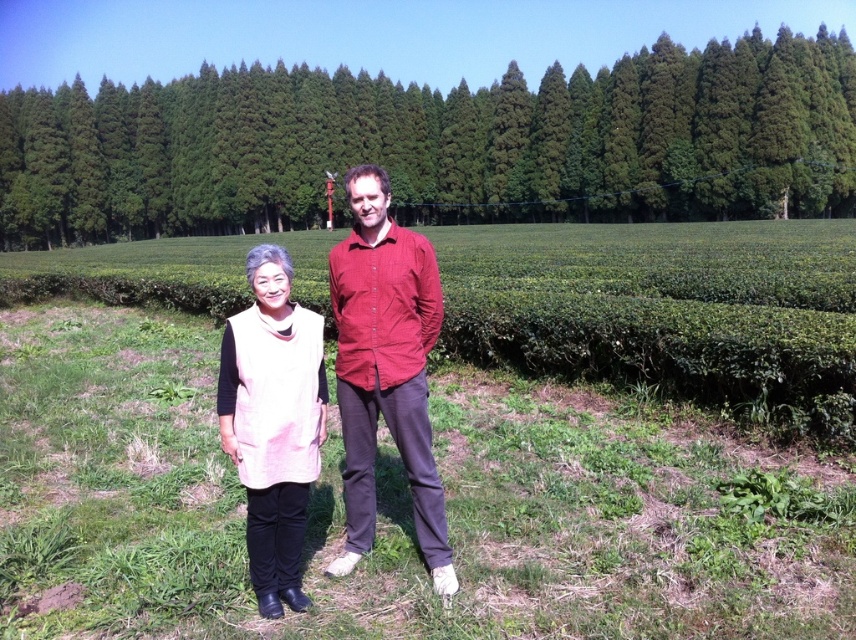
Question: Is green leafy trees at center positioned behind pink fabric vest at center?

Choices:
 (A) yes
 (B) no

Answer: (A)

Question: Which object is closer to the camera taking this photo?

Choices:
 (A) pink fabric vest at center
 (B) green leafy trees at center

Answer: (A)

Question: Estimate the real-world distances between objects in this image. Which object is farther from the green leafy vineyard at center?

Choices:
 (A) pink fabric vest at center
 (B) matte red shirt at center

Answer: (A)

Question: Is green leafy trees at center bigger than pink fabric vest at center?

Choices:
 (A) no
 (B) yes

Answer: (B)

Question: Observing the image, what is the correct spatial positioning of green leafy vineyard at center in reference to green leafy trees at center?

Choices:
 (A) above
 (B) below

Answer: (B)

Question: Which point is closer to the camera taking this photo?

Choices:
 (A) (266, 356)
 (B) (292, 131)
 (C) (400, 321)
 (D) (746, 477)

Answer: (A)